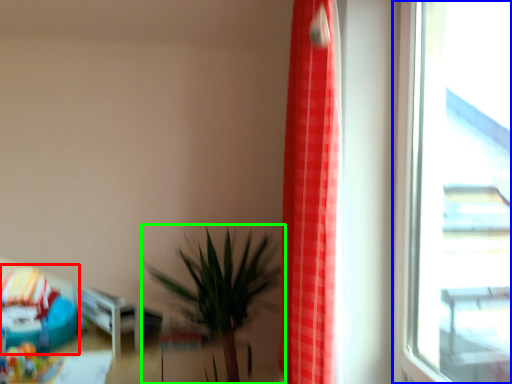
Question: Based on their relative distances, which object is nearer to bean bag chair (highlighted by a red box)? Choose from window (highlighted by a blue box) and houseplant (highlighted by a green box).

Choices:
 (A) window
 (B) houseplant

Answer: (B)